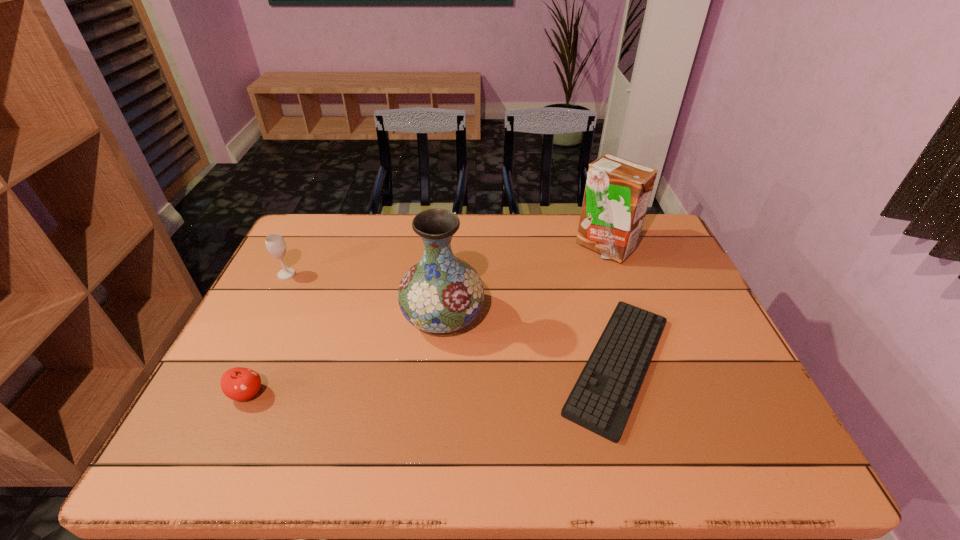
At what (x,y) coordinates should I click in order to perform the action: click on the third object from right to left. Please return your answer as a coordinate pair (x, y). This screenshot has height=540, width=960. Looking at the image, I should click on (440, 294).

You are a GUI agent. You are given a task and a screenshot of the screen. Output one action in this format:
    pyautogui.click(x=<x>, y=<y>)
    Task: Click on the carton
    
    Given the screenshot: What is the action you would take?
    pyautogui.click(x=617, y=193)

I want to click on wineglass, so click(x=275, y=243).

At what (x,y) coordinates should I click in order to perform the action: click on the fourth nearest object. Please return your answer as a coordinate pair (x, y). This screenshot has width=960, height=540. Looking at the image, I should click on (275, 243).

This screenshot has height=540, width=960. Identify the location of apple. (239, 384).

I want to click on the shortest object, so click(601, 400).

At what (x,y) coordinates should I click in order to perform the action: click on vacant region located on the left of the vase. Please return your answer as a coordinate pair (x, y). The image size is (960, 540). Looking at the image, I should click on (347, 317).

You are a GUI agent. You are given a task and a screenshot of the screen. Output one action in this format:
    pyautogui.click(x=<x>, y=<y>)
    Task: Click on the free region located on the straw side of the farthest object
    The image size is (960, 540).
    Given the screenshot: What is the action you would take?
    pyautogui.click(x=627, y=312)

Where is `free spot located 0.300m on the right of the wineglass`? free spot located 0.300m on the right of the wineglass is located at coordinates (395, 274).

At what (x,y) coordinates should I click in order to perform the action: click on vacant region located on the back of the second shortest object. Please return your answer as a coordinate pair (x, y). Looking at the image, I should click on (266, 354).